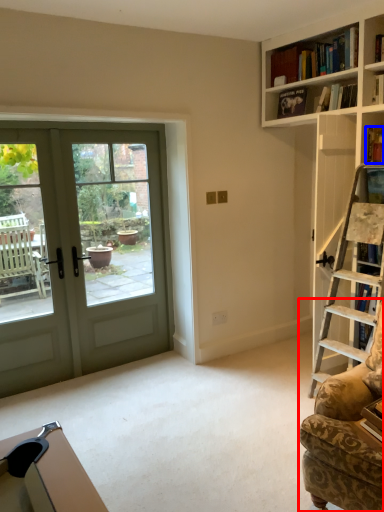
Question: Which object is closer to the camera taking this photo, rocking chair (highlighted by a red box) or book (highlighted by a blue box)?

Choices:
 (A) rocking chair
 (B) book

Answer: (A)